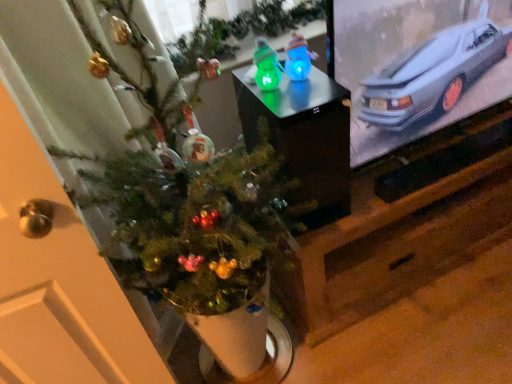
This screenshot has width=512, height=384. Identify the location of free spot in front of green translucent toy at center, marked as the second toy in a right-to-left arrangement. (291, 102).